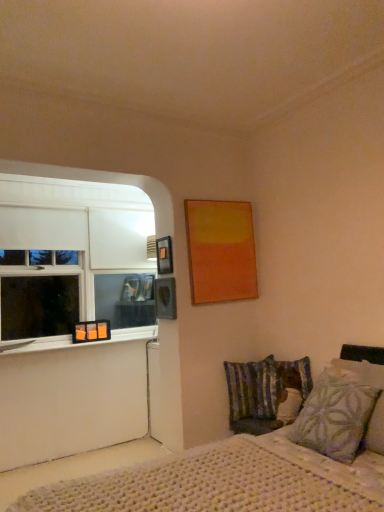
Locate an element on the screen. The height and width of the screenshot is (512, 384). free space above matte orange painting at upper right, the 1th picture frame in the right-to-left sequence (from a real-world perspective) is located at coordinates 216,198.